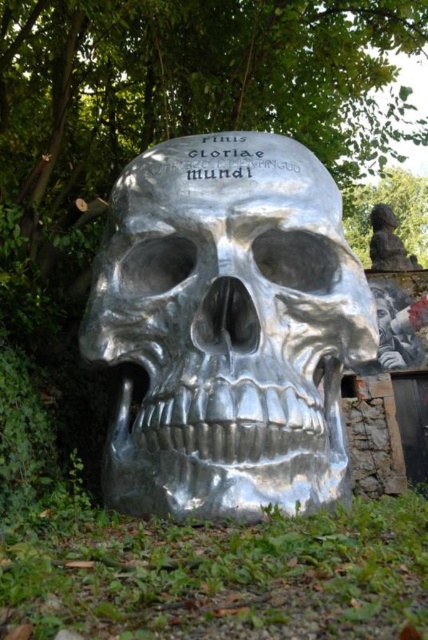
Is point (368, 352) in front of point (374, 237)?

Yes, point (368, 352) is closer to viewer.

Who is positioned more to the right, shiny metallic skull at center or satin silver skull at center?

Positioned to the right is satin silver skull at center.

You are a GUI agent. You are given a task and a screenshot of the screen. Output one action in this format:
    pyautogui.click(x=<x>, y=<y>)
    Task: Click on the shiny metallic skull at center
    The width and height of the screenshot is (428, 640).
    Given the screenshot: What is the action you would take?
    [228, 328]

Where is `shiny metallic skull at center`? shiny metallic skull at center is located at coordinates (228, 328).

Based on the photo, which is more to the left, shiny metallic skull at center or green leafy tree at upper center?

Positioned to the left is shiny metallic skull at center.

Can you confirm if shiny metallic skull at center is bigger than green leafy tree at upper center?

Correct, shiny metallic skull at center is larger in size than green leafy tree at upper center.

Between point (318, 163) and point (368, 253), which one is positioned in front?

Point (318, 163) is more forward.

Where is `shiny metallic skull at center`? The width and height of the screenshot is (428, 640). shiny metallic skull at center is located at coordinates (228, 328).

Is point (427, 250) positioned after point (374, 212)?

Yes, it is.

Where is `green leafy tree at upper center`? This screenshot has width=428, height=640. green leafy tree at upper center is located at coordinates (392, 211).